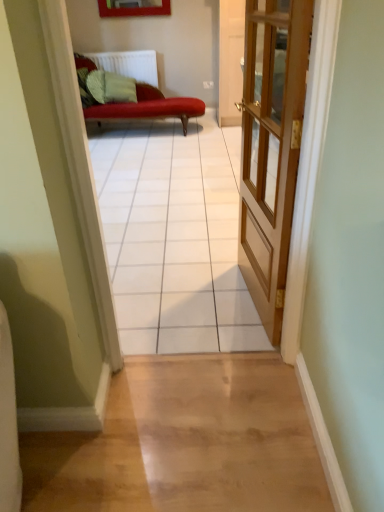
What is the approximate width of wooden door at center?

wooden door at center is 12.67 centimeters in width.

Where is `white plastic radiator at upper center`? white plastic radiator at upper center is located at coordinates (129, 64).

Is point (260, 249) closer or farther from the camera than point (137, 56)?

Clearly, point (260, 249) is closer to the camera than point (137, 56).

Is wooden door at center aimed at white plastic radiator at upper center?

No, wooden door at center does not turn towards white plastic radiator at upper center.

From a real-world perspective, which is physically above, wooden door at center or white plastic radiator at upper center?

wooden door at center is physically above.

Is wooden door at center in front of or behind white plastic radiator at upper center in the image?

wooden door at center is in front of white plastic radiator at upper center.

Which of these two, white plastic radiator at upper center or white tile floor at center, is wider?

Wider between the two is white tile floor at center.

Does white plastic radiator at upper center turn towards white tile floor at center?

Yes, white plastic radiator at upper center is facing white tile floor at center.

Which is behind, point (150, 60) or point (140, 191)?

The point (150, 60) is behind.

Could white tile floor at center be considered to be inside white plastic radiator at upper center?

No, white tile floor at center is not a part of white plastic radiator at upper center.

Between wooden door at center and white tile floor at center, which one is positioned in front?

white tile floor at center is more forward.

Which is closer to the camera, [278,175] or [234,139]?

Point [278,175] is positioned closer to the camera compared to point [234,139].

Can you confirm if wooden door at center is taller than white tile floor at center?

No.

Is white tile floor at center turned away from white plastic radiator at upper center?

No.

From the image's perspective, is white tile floor at center under white plastic radiator at upper center?

Indeed, from the image's perspective, white tile floor at center is shown beneath white plastic radiator at upper center.

Looking at this image, considering the positions of objects white tile floor at center and white plastic radiator at upper center in the image provided, who is more to the right, white tile floor at center or white plastic radiator at upper center?

Positioned to the right is white tile floor at center.

Is white tile floor at center taller or shorter than white plastic radiator at upper center?

Considering their sizes, white tile floor at center has more height than white plastic radiator at upper center.

From a real-world perspective, relative to wooden door at center, is white plastic radiator at upper center vertically above or below?

white plastic radiator at upper center is below wooden door at center.

Which object is thinner, white plastic radiator at upper center or wooden door at center?

wooden door at center.

Is point (120, 67) closer to viewer compared to point (283, 165)?

No.

Does white tile floor at center lie in front of wooden door at center?

Yes, white tile floor at center is closer to the viewer.

How different are the orientations of white tile floor at center and wooden door at center in degrees?

There is a 95.2-degree angle between the facing directions of white tile floor at center and wooden door at center.

From a real-world perspective, who is located lower, white tile floor at center or wooden door at center?

wooden door at center is physically lower.

This screenshot has height=512, width=384. I want to click on door on the right of white tile floor at center, so click(x=271, y=147).

Where is `door that is in front of the white plastic radiator at upper center`? The width and height of the screenshot is (384, 512). door that is in front of the white plastic radiator at upper center is located at coordinates (271, 147).

This screenshot has height=512, width=384. Find the location of `path lying below the white plastic radiator at upper center (from the image's perspective)`. path lying below the white plastic radiator at upper center (from the image's perspective) is located at coordinates (175, 239).

From the image, which object appears to be nearer to white plastic radiator at upper center, wooden door at center or white tile floor at center?

white tile floor at center is positioned closer to the anchor white plastic radiator at upper center.

From the picture: Estimate the real-world distances between objects in this image. Which object is further from wooden door at center, white tile floor at center or white plastic radiator at upper center?

white plastic radiator at upper center is positioned further to the anchor wooden door at center.

Consider the image. Looking at the image, which one is located further to white tile floor at center, white plastic radiator at upper center or wooden door at center?

Among the two, white plastic radiator at upper center is located further to white tile floor at center.

Based on their spatial positions, is wooden door at center or white plastic radiator at upper center closer to white tile floor at center?

The object closer to white tile floor at center is wooden door at center.

Estimate the real-world distances between objects in this image. Which object is closer to wooden door at center, white plastic radiator at upper center or white tile floor at center?

white tile floor at center.

Looking at the image, which one is located closer to white plastic radiator at upper center, white tile floor at center or wooden door at center?

Based on the image, white tile floor at center appears to be nearer to white plastic radiator at upper center.

What are the coordinates of `door positioned between white tile floor at center and white plastic radiator at upper center from near to far` in the screenshot? It's located at (271, 147).